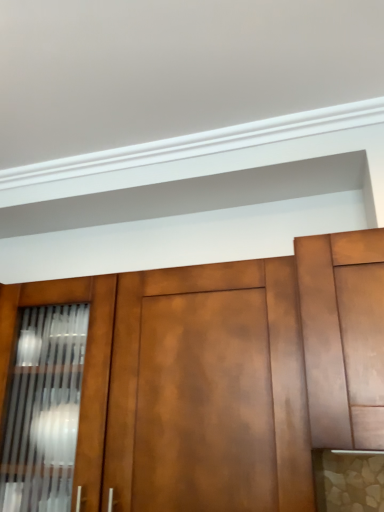
Question: From a real-world perspective, is matte wood cabinet at center, which ranks as the second cabinetry in right-to-left order, physically located above or below matte brown cabinet at right, marked as the first cabinetry in a right-to-left arrangement?

Choices:
 (A) below
 (B) above

Answer: (A)

Question: Considering the positions of matte wood cabinet at center, which is counted as the first cabinetry, starting from the left, and matte brown cabinet at right, arranged as the 2th cabinetry when viewed from the left, in the image, is matte wood cabinet at center, which is counted as the first cabinetry, starting from the left, taller or shorter than matte brown cabinet at right, arranged as the 2th cabinetry when viewed from the left,?

Choices:
 (A) tall
 (B) short

Answer: (A)

Question: Based on their positions, is matte wood cabinet at center, which is counted as the first cabinetry, starting from the left, located to the left or right of matte brown cabinet at right, arranged as the 2th cabinetry when viewed from the left?

Choices:
 (A) right
 (B) left

Answer: (B)

Question: From a real-world perspective, is matte brown cabinet at right, marked as the first cabinetry in a right-to-left arrangement, physically located above or below matte wood cabinet at center, which ranks as the second cabinetry in right-to-left order?

Choices:
 (A) above
 (B) below

Answer: (A)

Question: Is matte brown cabinet at right, arranged as the 2th cabinetry when viewed from the left, inside or outside of matte wood cabinet at center, which ranks as the second cabinetry in right-to-left order?

Choices:
 (A) inside
 (B) outside

Answer: (B)

Question: In terms of height, does matte brown cabinet at right, arranged as the 2th cabinetry when viewed from the left, look taller or shorter compared to matte wood cabinet at center, which ranks as the second cabinetry in right-to-left order?

Choices:
 (A) tall
 (B) short

Answer: (B)

Question: From the image's perspective, is matte brown cabinet at right, arranged as the 2th cabinetry when viewed from the left, positioned above or below matte wood cabinet at center, which is counted as the first cabinetry, starting from the left?

Choices:
 (A) above
 (B) below

Answer: (A)